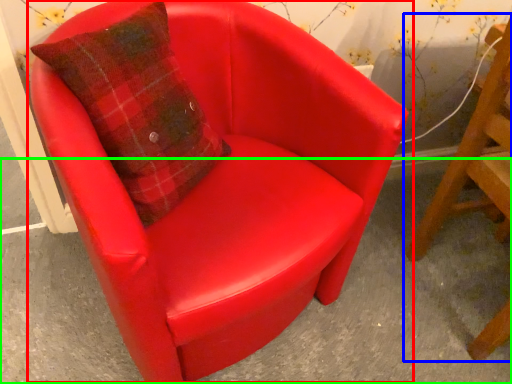
Question: Which object is the closest to the chair (highlighted by a red box)? Choose among these: chair (highlighted by a blue box) or concrete (highlighted by a green box).

Choices:
 (A) chair
 (B) concrete

Answer: (B)